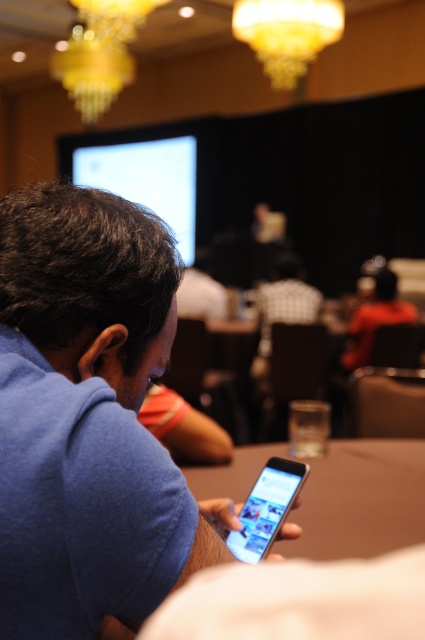
Question: Which object is the farthest from the brown wooden table at center?

Choices:
 (A) silver metallic smartphone at center
 (B) orange shirt at center

Answer: (B)

Question: Is brown wooden table at center to the left of orange shirt at center from the viewer's perspective?

Choices:
 (A) no
 (B) yes

Answer: (B)

Question: Does silver metallic smartphone at center have a smaller size compared to orange shirt at center?

Choices:
 (A) yes
 (B) no

Answer: (A)

Question: Estimate the real-world distances between objects in this image. Which object is closer to the silver metallic smartphone at center?

Choices:
 (A) brown wooden table at center
 (B) orange shirt at center

Answer: (A)

Question: Which of the following is the farthest from the observer?

Choices:
 (A) brown wooden table at center
 (B) orange shirt at center
 (C) silver metallic smartphone at center

Answer: (B)

Question: Is silver metallic smartphone at center positioned before orange shirt at center?

Choices:
 (A) no
 (B) yes

Answer: (B)